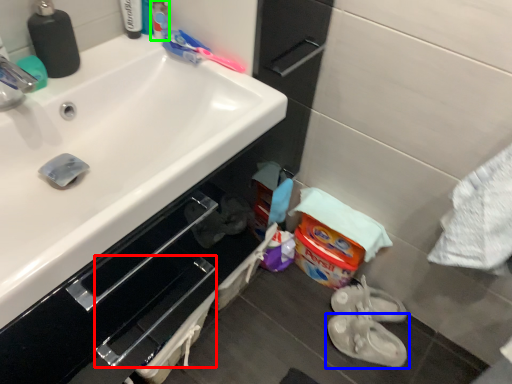
Question: Based on their relative distances, which object is farther from drawer (highlighted by a red box)? Choose from footwear (highlighted by a blue box) and toiletry (highlighted by a green box).

Choices:
 (A) footwear
 (B) toiletry

Answer: (B)